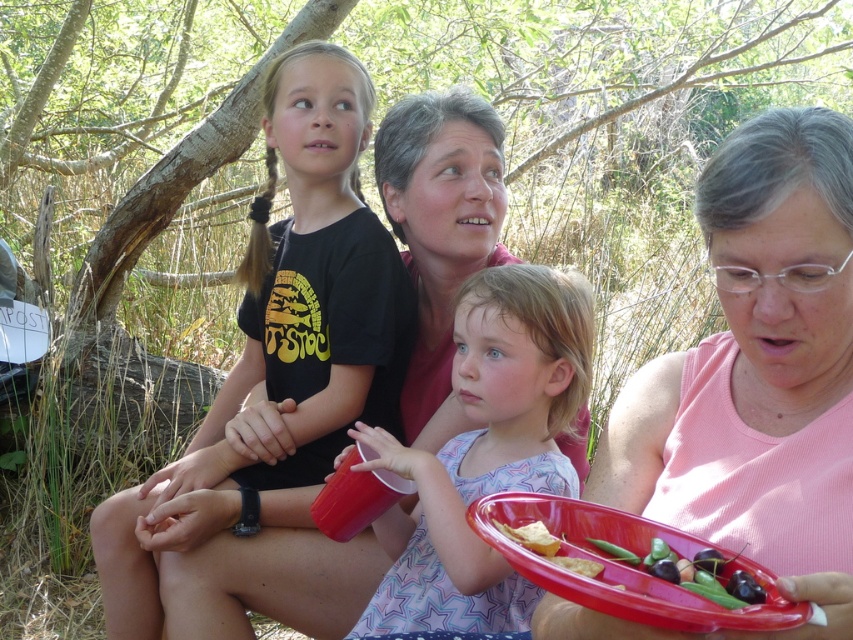
Question: Among these objects, which one is farthest from the camera?

Choices:
 (A) black matte t-shirt at upper left
 (B) golden crispy chips at lower center
 (C) pastel cotton dress at center
 (D) pink fabric tray at right

Answer: (A)

Question: Does pink fabric tray at right appear over black matte t-shirt at upper left?

Choices:
 (A) no
 (B) yes

Answer: (A)

Question: Does pink fabric tray at right appear over black matte t-shirt at upper left?

Choices:
 (A) no
 (B) yes

Answer: (A)

Question: Is black matte t-shirt at upper left above golden crispy chips at lower center?

Choices:
 (A) no
 (B) yes

Answer: (B)

Question: Considering the real-world distances, which object is closest to the golden crispy chips at lower center?

Choices:
 (A) pastel cotton dress at center
 (B) black matte t-shirt at upper left
 (C) pink fabric tray at right

Answer: (C)

Question: Which object appears farthest from the camera in this image?

Choices:
 (A) black matte t-shirt at upper left
 (B) pink fabric tray at right
 (C) golden crispy chips at lower center
 (D) pastel cotton dress at center

Answer: (A)